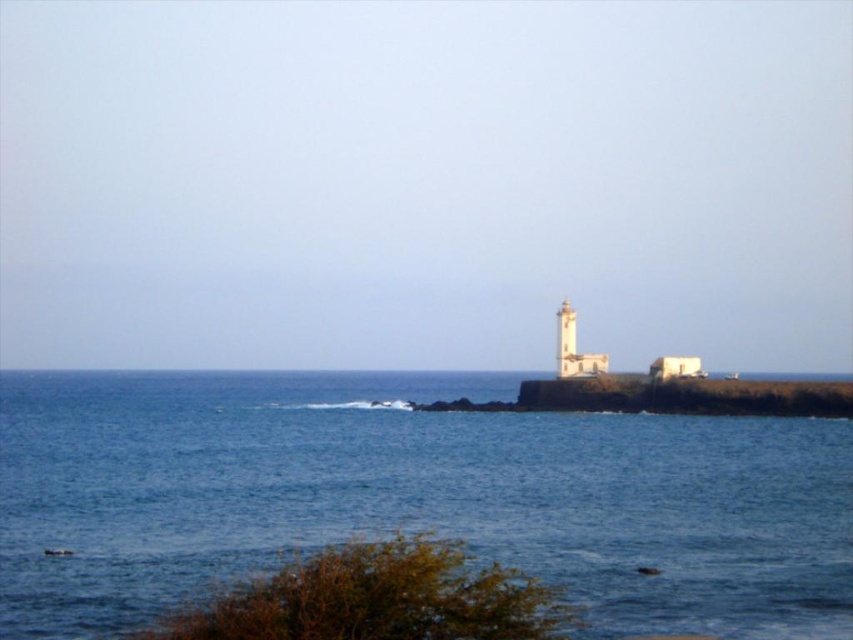
The height and width of the screenshot is (640, 853). I want to click on blue water at center, so click(412, 497).

Does blue water at center appear on the left side of white painted concrete tower at center?

Correct, you'll find blue water at center to the left of white painted concrete tower at center.

Where is `blue water at center`? blue water at center is located at coordinates (412, 497).

Based on the photo, is white stucco lighthouse at center taller than white painted concrete tower at center?

Correct, white stucco lighthouse at center is much taller as white painted concrete tower at center.

Between point (606, 365) and point (560, 307), which one is positioned behind?

Point (560, 307)

Locate an element on the screen. This screenshot has width=853, height=640. white stucco lighthouse at center is located at coordinates (573, 348).

Does blue water at center have a greater width compared to white stucco lighthouse at center?

Indeed, blue water at center has a greater width compared to white stucco lighthouse at center.

Who is taller, blue water at center or white stucco lighthouse at center?

white stucco lighthouse at center is taller.

The height and width of the screenshot is (640, 853). What do you see at coordinates (412, 497) in the screenshot?
I see `blue water at center` at bounding box center [412, 497].

This screenshot has width=853, height=640. Identify the location of blue water at center. (412, 497).